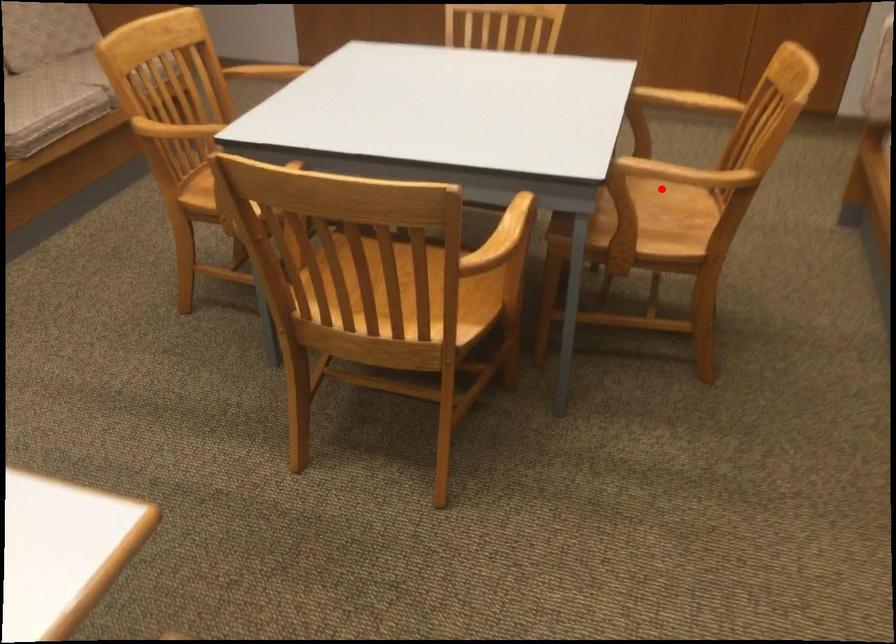
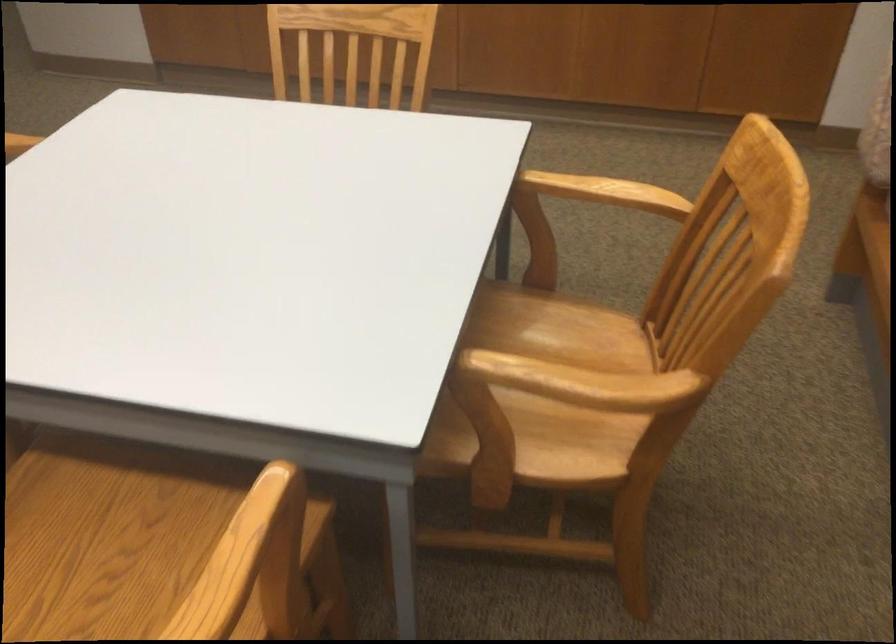
Question: I am providing you with two images of the same scene from different viewpoints. Image1 has a red point marked. In image2, the corresponding 3D location appears at what relative position? Reply with the corresponding letter.

Choices:
 (A) Closer
 (B) Farther

Answer: (A)